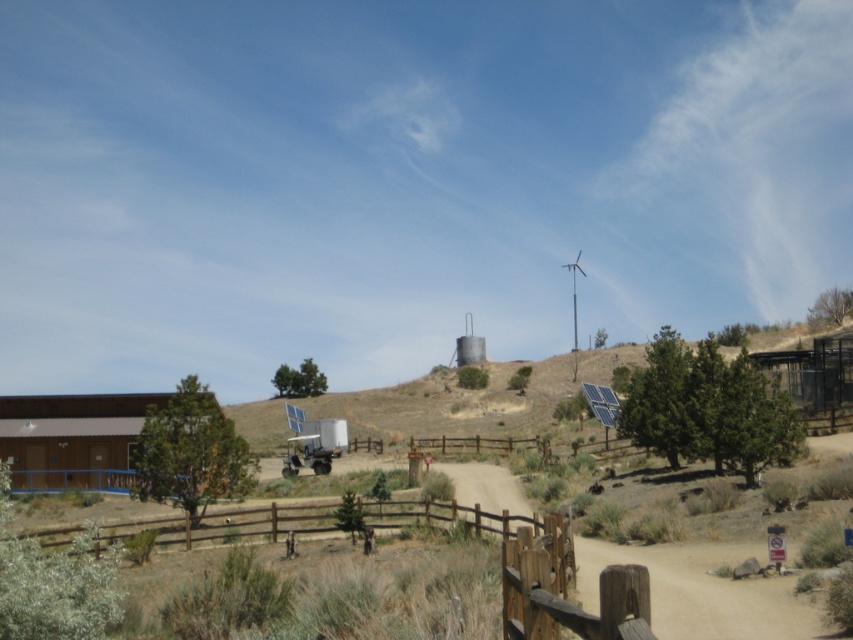
Is metallic gray silo at center to the right of white plastic wind turbine at upper center from the viewer's perspective?

No, metallic gray silo at center is not to the right of white plastic wind turbine at upper center.

Between point (463, 337) and point (575, 301), which one is positioned behind?

The point (575, 301) is behind.

Find the location of a particular element. The width and height of the screenshot is (853, 640). metallic gray silo at center is located at coordinates (469, 346).

Looking at this image, which is above, brown dirt hillside at center or metallic gray silo at center?

metallic gray silo at center is above.

Which is below, brown dirt hillside at center or metallic gray silo at center?

Positioned lower is brown dirt hillside at center.

Find the location of a particular element. The height and width of the screenshot is (640, 853). brown dirt hillside at center is located at coordinates (453, 404).

The width and height of the screenshot is (853, 640). I want to click on brown dirt hillside at center, so click(x=453, y=404).

Who is taller, wooden fence at lower center or metallic gray silo at center?

metallic gray silo at center

Does wooden fence at lower center have a larger size compared to metallic gray silo at center?

Yes.

Between point (398, 513) and point (465, 323), which one is positioned behind?

The point (465, 323) is behind.

I want to click on wooden fence at lower center, so click(x=554, y=579).